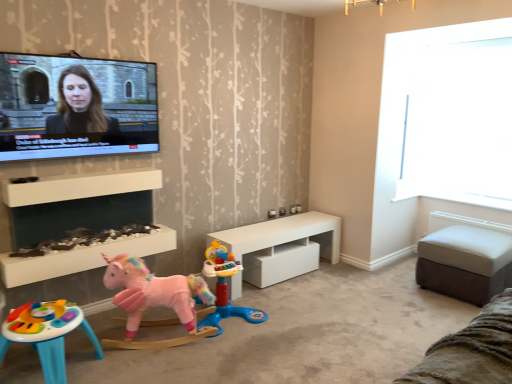
This screenshot has height=384, width=512. Identify the location of free spot below transparent glass window at upper right (from a real-world perspective). (467, 195).